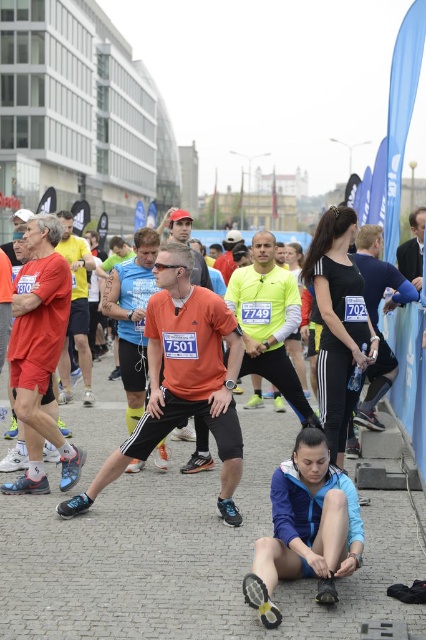
You are a runner participating in the marathon and you want to move from the starting line to the finish line. There are two points marked on the route. The first point is at coordinate point (268, 577) and the second point is at coordinate point (374, 337). Which point should you reach first?

You should reach point (268, 577) first because it is in front of point (374, 337) along the route.

You are a photographer positioned at the starting line of the marathon. You want to take a photo that includes both the blue fabric jacket at lower center and the black matte running shoes at center. Which object should you adjust your camera angle to focus on first to ensure both are in frame?

The blue fabric jacket at lower center is in front of the black matte running shoes at center, so you should focus on the blue fabric jacket at lower center first to ensure both are visible in the photo.